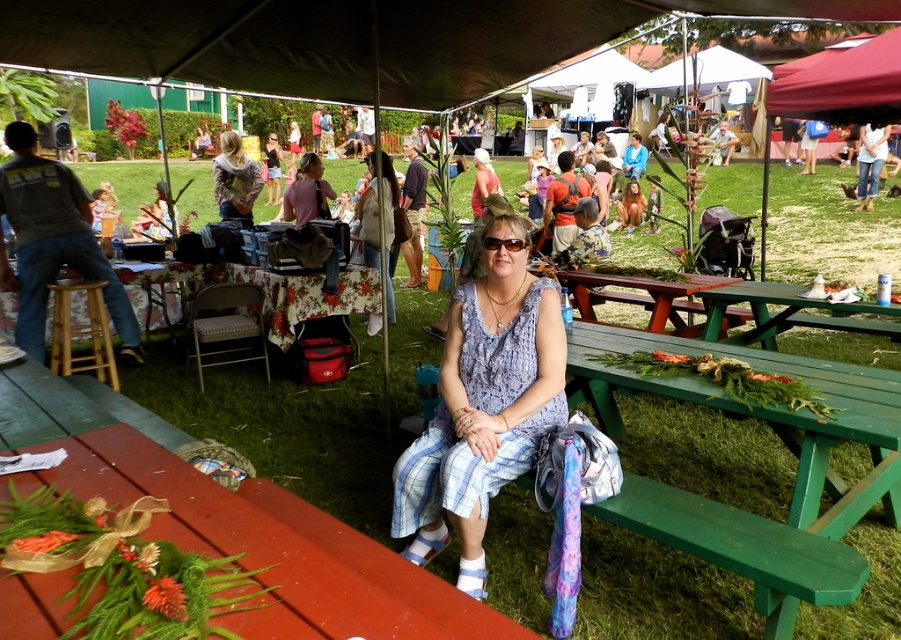
Question: Can you confirm if green wooden picnic table at center is smaller than green wood picnic table at center?

Choices:
 (A) yes
 (B) no

Answer: (B)

Question: Which point is closer to the camera?

Choices:
 (A) gray cotton shirt at left
 (B) denim jeans at center

Answer: (B)

Question: Estimate the real-world distances between objects in this image. Which object is closer to the wooden picnic table at lower left?

Choices:
 (A) denim jeans at center
 (B) camouflage hoodie at center
 (C) matte blue dress at center
 (D) gray cotton shirt at left

Answer: (C)

Question: Is the position of wooden picnic table at lower left less distant than that of denim jeans at center?

Choices:
 (A) no
 (B) yes

Answer: (B)

Question: Considering the real-world distances, which object is farthest from the wooden stool at left?

Choices:
 (A) denim jeans at center
 (B) wooden picnic table at lower left
 (C) green wood picnic table at center
 (D) gray cotton shirt at left

Answer: (C)

Question: Is green wood picnic table at lower right bigger than green wood picnic table at center?

Choices:
 (A) yes
 (B) no

Answer: (A)